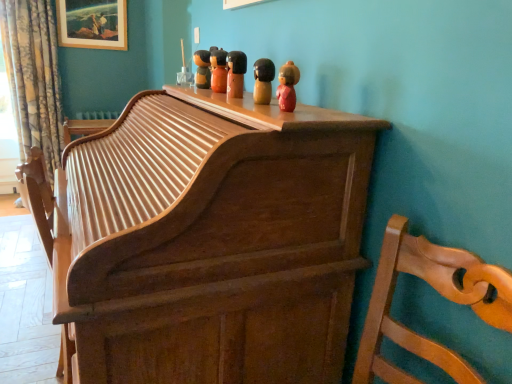
Image resolution: width=512 pixels, height=384 pixels. In order to click on matte wooden doll at center, the 4th toy from the right in this screenshot , I will do `click(218, 70)`.

The image size is (512, 384). What do you see at coordinates (218, 70) in the screenshot?
I see `matte wooden doll at center, the 4th toy positioned from the front` at bounding box center [218, 70].

Measure the distance between point (208, 68) and camera.

Point (208, 68) and camera are 5.83 feet apart.

Based on the photo, in order to face matte black figurine at upper center, which appears as the third toy when viewed from the left, should I rotate leftwards or rightwards?

To align with it, rotate left about 2.973°.

In the scene shown: In order to face wooden figurine at upper center, placed as the 5th toy when sorted from back to front, should I rotate leftwards or rightwards?

Turn right approximately 4.099 degrees to face it.

You are a GUI agent. You are given a task and a screenshot of the screen. Output one action in this format:
    pyautogui.click(x=<x>, y=<y>)
    Task: Click on the wooden figurine at upper center, placed as the 5th toy when sorted from back to front
    
    Given the screenshot: What is the action you would take?
    pyautogui.click(x=287, y=86)

Where is `floral fabric curtain at left`? The image size is (512, 384). floral fabric curtain at left is located at coordinates (33, 76).

From the picture: How many degrees apart are the facing directions of wooden figurine at center, the 4th toy from the left, and matte black figurine at upper center, which appears as the third toy when viewed from the left?

1.37 degrees.

Considering the sizes of objects wooden figurine at center, acting as the 2th toy starting from the right, and matte black figurine at upper center, which appears as the third toy when viewed from the left, in the image provided, who is wider, wooden figurine at center, acting as the 2th toy starting from the right, or matte black figurine at upper center, which appears as the third toy when viewed from the left,?

With larger width is matte black figurine at upper center, which appears as the third toy when viewed from the left.

Could you tell me if wooden figurine at center, acting as the 2th toy starting from the right, is facing matte black figurine at upper center, the 3th toy positioned from the right?

No, wooden figurine at center, acting as the 2th toy starting from the right, is not aimed at matte black figurine at upper center, the 3th toy positioned from the right.

Is wooden figurine at center, acting as the 2th toy starting from the right, to the right of matte black figurine at upper center, the 3th toy positioned from the right, from the viewer's perspective?

Yes.

Can you confirm if matte wooden doll at center, acting as the 2th toy starting from the back, is thinner than matte black figurine at upper center, which appears as the third toy when viewed from the left?

No.

Considering the points (223, 87) and (230, 95), which point is behind, point (223, 87) or point (230, 95)?

The point (223, 87) is more distant.

Does matte wooden doll at center, acting as the 2th toy starting from the back, turn towards matte black figurine at upper center, which appears as the 3th toy when viewed from the front?

No, matte wooden doll at center, acting as the 2th toy starting from the back, is not aimed at matte black figurine at upper center, which appears as the 3th toy when viewed from the front.

Between matte wooden doll at center, the 4th toy from the right, and matte black figurine at upper center, the 3th toy positioned from the right, which one has more height?

Standing taller between the two is matte wooden doll at center, the 4th toy from the right.

Is matte wooden doll at center, acting as the second toy starting from the left, with floral fabric curtain at left?

matte wooden doll at center, acting as the second toy starting from the left, and floral fabric curtain at left are not in contact.

Consider the image. Is matte wooden doll at center, the 4th toy positioned from the front, aimed at floral fabric curtain at left?

No, matte wooden doll at center, the 4th toy positioned from the front, is not facing towards floral fabric curtain at left.

Who is taller, matte wooden doll at center, the 4th toy from the right, or floral fabric curtain at left?

Standing taller between the two is floral fabric curtain at left.

Considering the sizes of matte wooden doll at center, acting as the second toy starting from the left, and floral fabric curtain at left in the image, is matte wooden doll at center, acting as the second toy starting from the left, bigger or smaller than floral fabric curtain at left?

matte wooden doll at center, acting as the second toy starting from the left, is smaller than floral fabric curtain at left.

Is wooden chair at right oriented away from matte black figurine at upper center, which appears as the third toy when viewed from the back?

wooden chair at right does not have its back to matte black figurine at upper center, which appears as the third toy when viewed from the back.

Based on the photo, from the image's perspective, relative to matte black figurine at upper center, which appears as the third toy when viewed from the left, is wooden chair at right above or below?

From the image's perspective, wooden chair at right appears below matte black figurine at upper center, which appears as the third toy when viewed from the left.

Considering the positions of point (511, 328) and point (238, 76), is point (511, 328) closer or farther from the camera than point (238, 76)?

Point (511, 328) is closer to the camera than point (238, 76).

Is wooden chair at right far from matte black figurine at upper center, the 3th toy positioned from the right?

Actually, wooden chair at right and matte black figurine at upper center, the 3th toy positioned from the right, are a little close together.

From a real-world perspective, who is located lower, wooden picture frame at upper left or wooden figurine at center, the 4th toy from the left?

In real-world perspective, wooden figurine at center, the 4th toy from the left, is lower.

Is wooden picture frame at upper left to the left of wooden figurine at center, the 4th toy from the back, from the viewer's perspective?

Yes, wooden picture frame at upper left is to the left of wooden figurine at center, the 4th toy from the back.

Does point (85, 43) appear closer or farther from the camera than point (267, 73)?

Point (85, 43) is positioned farther from the camera compared to point (267, 73).

Considering the sizes of objects wooden picture frame at upper left and wooden figurine at center, acting as the 2th toy starting from the front, in the image provided, who is bigger, wooden picture frame at upper left or wooden figurine at center, acting as the 2th toy starting from the front,?

Bigger between the two is wooden picture frame at upper left.

Is wooden picture frame at upper left not near wooden figurine at upper center, the first toy positioned from the right?

Indeed, wooden picture frame at upper left is not near wooden figurine at upper center, the first toy positioned from the right.

From their relative heights in the image, would you say wooden picture frame at upper left is taller or shorter than wooden figurine at upper center, which is counted as the first toy, starting from the front?

wooden picture frame at upper left is taller than wooden figurine at upper center, which is counted as the first toy, starting from the front.

Is wooden picture frame at upper left behind wooden figurine at upper center, placed as the 5th toy when sorted from back to front?

Yes, wooden picture frame at upper left is further from the viewer.

From a real-world perspective, who is located higher, wooden figurine at center, the 4th toy from the back, or wooden piano at center?

From a 3D spatial view, wooden figurine at center, the 4th toy from the back, is above.

Considering the sizes of wooden figurine at center, acting as the 2th toy starting from the front, and wooden piano at center in the image, is wooden figurine at center, acting as the 2th toy starting from the front, bigger or smaller than wooden piano at center?

Considering their sizes, wooden figurine at center, acting as the 2th toy starting from the front, takes up less space than wooden piano at center.

From the image's perspective, which is below, wooden figurine at center, the 4th toy from the back, or wooden piano at center?

wooden piano at center is shown below in the image.

Between wooden figurine at center, the 4th toy from the left, and wooden piano at center, which one has larger width?

Wider between the two is wooden piano at center.

The height and width of the screenshot is (384, 512). In order to click on the 1st toy to the left of the wooden figurine at center, the 4th toy from the left, counting from the anchor's position in this screenshot , I will do `click(236, 73)`.

Which toy is the 1st one when counting from the right side of the matte wooden doll at center, acting as the second toy starting from the left? Please provide its 2D coordinates.

[(236, 73)]

From the image, which object appears to be nearer to wooden doll at upper center, positioned as the 5th toy in right-to-left order, wooden figurine at upper center, placed as the 5th toy when sorted from back to front, or wooden picture frame at upper left?

wooden figurine at upper center, placed as the 5th toy when sorted from back to front, is closer to wooden doll at upper center, positioned as the 5th toy in right-to-left order.

Estimate the real-world distances between objects in this image. Which object is further from wooden doll at upper center, acting as the fifth toy starting from the front, wooden picture frame at upper left or wooden figurine at center, the 4th toy from the back?

wooden picture frame at upper left.

Which object lies further to the anchor point matte black figurine at upper center, which appears as the 3th toy when viewed from the front, wooden doll at upper center, acting as the fifth toy starting from the front, or matte wooden doll at center, the 4th toy from the right?

wooden doll at upper center, acting as the fifth toy starting from the front.

Looking at this image, when comparing their distances from wooden piano at center, does matte black figurine at upper center, which appears as the third toy when viewed from the left, or wooden figurine at upper center, which ranks as the fifth toy in left-to-right order, seem closer?

wooden figurine at upper center, which ranks as the fifth toy in left-to-right order, lies closer to wooden piano at center than the other object.

Which object lies further to the anchor point matte wooden doll at center, the 4th toy from the right, wooden chair at right or wooden doll at upper center, positioned as the 5th toy in right-to-left order?

The object further to matte wooden doll at center, the 4th toy from the right, is wooden chair at right.

Estimate the real-world distances between objects in this image. Which object is closer to wooden doll at upper center, positioned as the 5th toy in right-to-left order, wooden picture frame at upper left or wooden piano at center?

wooden piano at center lies closer to wooden doll at upper center, positioned as the 5th toy in right-to-left order, than the other object.

Based on their spatial positions, is wooden picture frame at upper left or wooden doll at upper center, positioned as the 5th toy in right-to-left order, further from floral fabric curtain at left?

wooden doll at upper center, positioned as the 5th toy in right-to-left order.

Which object lies further to the anchor point matte wooden doll at center, acting as the second toy starting from the left, wooden piano at center or wooden figurine at center, the 4th toy from the back?

Among the two, wooden piano at center is located further to matte wooden doll at center, acting as the second toy starting from the left.

At what (x,y) coordinates should I click in order to perform the action: click on curtain between matte wooden doll at center, the 4th toy positioned from the front, and wooden picture frame at upper left in the front-back direction. Please return your answer as a coordinate pair (x, y). Looking at the image, I should click on (33, 76).

You are a GUI agent. You are given a task and a screenshot of the screen. Output one action in this format:
    pyautogui.click(x=<x>, y=<y>)
    Task: Click on the piano between wooden chair at right and matte black figurine at upper center, which appears as the third toy when viewed from the back, from front to back
    
    Given the screenshot: What is the action you would take?
    pyautogui.click(x=210, y=242)

Image resolution: width=512 pixels, height=384 pixels. Identify the location of piano between wooden figurine at upper center, which ranks as the fifth toy in left-to-right order, and wooden chair at right from top to bottom. [210, 242].

You are a GUI agent. You are given a task and a screenshot of the screen. Output one action in this format:
    pyautogui.click(x=<x>, y=<y>)
    Task: Click on the toy between wooden figurine at center, acting as the 2th toy starting from the right, and matte wooden doll at center, the 4th toy from the right, in the front-back direction
    The height and width of the screenshot is (384, 512).
    Given the screenshot: What is the action you would take?
    pyautogui.click(x=236, y=73)